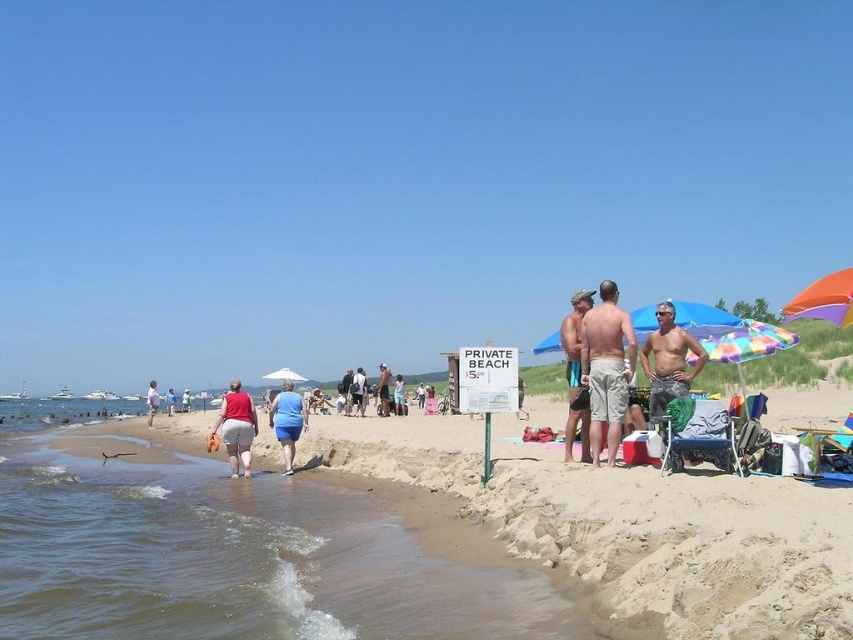
You are a photographer trying to capture a candid shot of the shiny metallic tank top at center right and the tan fabric shorts at center. Since you want both items to be clearly visible in the frame, which object should you focus on to ensure it takes up more space in your photo?

The tan fabric shorts at center should be focused on because it occupies more space than the shiny metallic tank top at center right, ensuring it will be clearly visible in the frame.

You are a photographer trying to capture a closeup of the matte red shorts at lower center. However, the tan fabric shorts at center are blocking the view. Can you adjust your position to take the photo without moving the subjects?

The matte red shorts at lower center is positioned over the tan fabric shorts at center, so adjusting your position might not help as the matte red shorts are already covering the tan fabric shorts. You may need to ask the subjects to move slightly to get an unobstructed view.

You are a photographer trying to capture a wide shot of the beach scene. You notice the tan skin man at center and the light blue denim shorts at lower left. Which object should you focus on to ensure both are in the frame without cropping? Explain your reasoning.

You should focus on the tan skin man at center because it has a smaller width than the light blue denim shorts at lower left, making it easier to fit both into the frame without cropping.